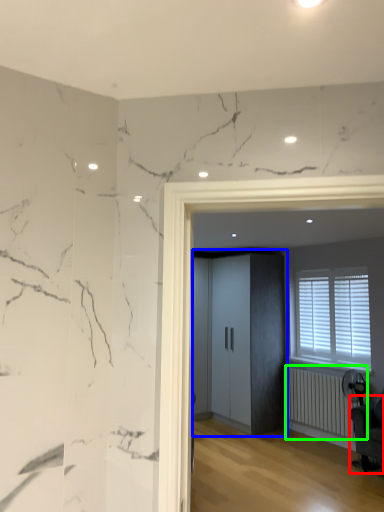
Question: Estimate the real-world distances between objects in this image. Which object is farther from swivel chair (highlighted by a red box), elevator (highlighted by a blue box) or radiator (highlighted by a green box)?

Choices:
 (A) elevator
 (B) radiator

Answer: (A)